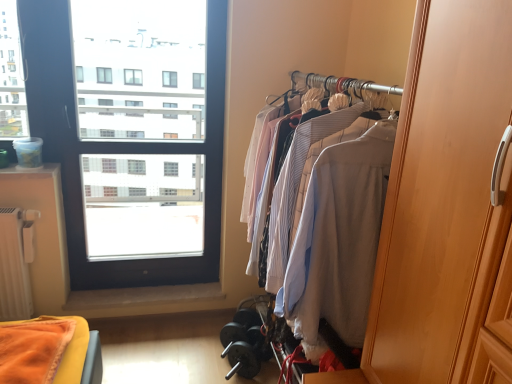
Find the location of a particular element. transparent glass window at upper left is located at coordinates [130, 132].

Locate an element on the screen. Image resolution: width=512 pixels, height=384 pixels. wooden wardrobe at right is located at coordinates 443,196.

Is light beige wood closet at right inside the boundaries of wooden wardrobe at right, or outside?

light beige wood closet at right lies outside wooden wardrobe at right.

Does light beige wood closet at right have a larger size compared to wooden wardrobe at right?

Indeed, light beige wood closet at right has a larger size compared to wooden wardrobe at right.

Is light beige wood closet at right not close to wooden wardrobe at right?

No, light beige wood closet at right is not far away from wooden wardrobe at right.

From a real-world perspective, is light beige wood closet at right located beneath wooden wardrobe at right?

Yes.

Is point (400, 267) closer to camera compared to point (361, 118)?

Yes, point (400, 267) is in front of point (361, 118).

Does wooden wardrobe at right turn towards light beige wood closet at right?

No, wooden wardrobe at right is not oriented towards light beige wood closet at right.

Is wooden wardrobe at right positioned far away from light beige wood closet at right?

That's not correct — wooden wardrobe at right is a little close to light beige wood closet at right.

Considering the sizes of transparent glass window at upper left and wooden wardrobe at right in the image, is transparent glass window at upper left wider or thinner than wooden wardrobe at right?

Considering their sizes, transparent glass window at upper left looks slimmer than wooden wardrobe at right.

Could wooden wardrobe at right be considered to be inside transparent glass window at upper left?

No, wooden wardrobe at right is not surrounded by transparent glass window at upper left.

Which is more to the left, transparent glass window at upper left or wooden wardrobe at right?

Positioned to the left is transparent glass window at upper left.

This screenshot has height=384, width=512. Identify the location of screen door lying on the right of transparent glass window at upper left. (443, 196).

Can you confirm if light beige wood closet at right is bigger than transparent glass window at upper left?

Correct, light beige wood closet at right is larger in size than transparent glass window at upper left.

How different are the orientations of light beige wood closet at right and transparent glass window at upper left in degrees?

The angle between the facing direction of light beige wood closet at right and the facing direction of transparent glass window at upper left is 90.2 degrees.

Locate an element on the screen. The height and width of the screenshot is (384, 512). window that is behind the light beige wood closet at right is located at coordinates (130, 132).

Is the position of light beige wood closet at right less distant than that of transparent glass window at upper left?

Yes, light beige wood closet at right is in front of transparent glass window at upper left.

In the scene shown: Can you confirm if wooden wardrobe at right is taller than transparent glass window at upper left?

No.

Is wooden wardrobe at right smaller than transparent glass window at upper left?

No.

Based on the photo, relative to transparent glass window at upper left, is wooden wardrobe at right in front or behind?

In the image, wooden wardrobe at right appears in front of transparent glass window at upper left.

Where is `screen door below the transparent glass window at upper left (from the image's perspective)`? This screenshot has height=384, width=512. screen door below the transparent glass window at upper left (from the image's perspective) is located at coordinates (443, 196).

Looking at the image, does transparent glass window at upper left seem bigger or smaller compared to light beige wood closet at right?

Clearly, transparent glass window at upper left is smaller in size than light beige wood closet at right.

From a real-world perspective, who is located higher, transparent glass window at upper left or light beige wood closet at right?

transparent glass window at upper left is physically above.

Which object is closer to the camera taking this photo, transparent glass window at upper left or light beige wood closet at right?

light beige wood closet at right is more forward.

Which object is positioned more to the right, transparent glass window at upper left or light beige wood closet at right?

From the viewer's perspective, light beige wood closet at right appears more on the right side.

This screenshot has height=384, width=512. In order to click on screen door located above the light beige wood closet at right (from a real-world perspective) in this screenshot , I will do `click(443, 196)`.

In order to click on closet behind the wooden wardrobe at right in this screenshot , I will do `click(298, 159)`.

Which object lies further to the anchor point light beige wood closet at right, wooden wardrobe at right or transparent glass window at upper left?

transparent glass window at upper left is positioned further to the anchor light beige wood closet at right.

Looking at the image, which one is located further to light beige wood closet at right, transparent glass window at upper left or wooden wardrobe at right?

Answer: transparent glass window at upper left.

Looking at the image, which one is located further to wooden wardrobe at right, transparent glass window at upper left or light beige wood closet at right?

transparent glass window at upper left.

Considering their positions, is light beige wood closet at right positioned further to wooden wardrobe at right than transparent glass window at upper left?

transparent glass window at upper left.

Which object lies further to the anchor point transparent glass window at upper left, light beige wood closet at right or wooden wardrobe at right?

wooden wardrobe at right is positioned further to the anchor transparent glass window at upper left.

Estimate the real-world distances between objects in this image. Which object is closer to transparent glass window at upper left, wooden wardrobe at right or light beige wood closet at right?

light beige wood closet at right.

Identify the location of closet between wooden wardrobe at right and transparent glass window at upper left in the front-back direction. The height and width of the screenshot is (384, 512). (298, 159).